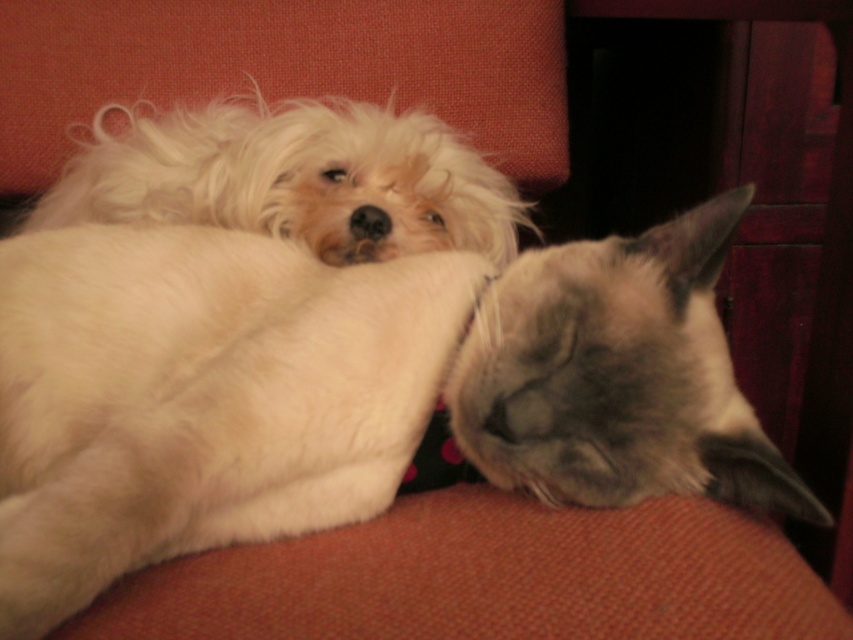
You are holding a 60 cm long measuring tape and want to measure the distance from the camera to the point at coordinates [663,464]. Can you reach it with your tape?

The distance between the camera and the point at coordinates [663,464] is 57.29 centimeters. Since your tape is 60 cm long, which is longer than the required distance, you can reach it with your tape.